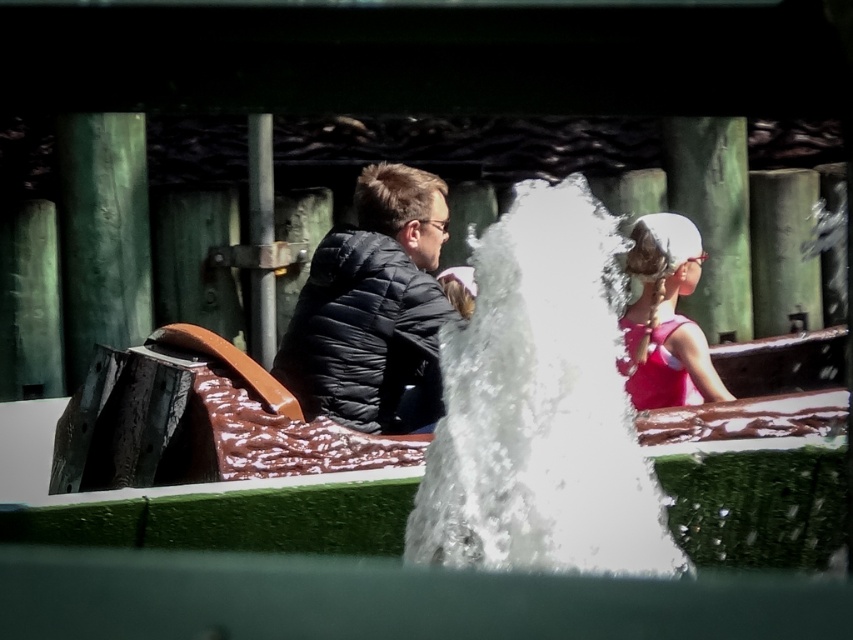
You are an observer standing at the edge of the amusement park ride. You notice the white frothy water at center and the pink fabric hair at upper right. Which object takes up more space in the image?

The white frothy water at center takes up more space in the image than the pink fabric hair at upper right because it is bigger.

What are the coordinates of the black puffer jacket at center?

The coordinates of the black puffer jacket at center are at point (373, 308).

You are a photographer trying to capture a photo of the pink fabric hair at upper right and the white frothy water at center. Which object is located to the left of the other?

The white frothy water at center is positioned on the left side of pink fabric hair at upper right.